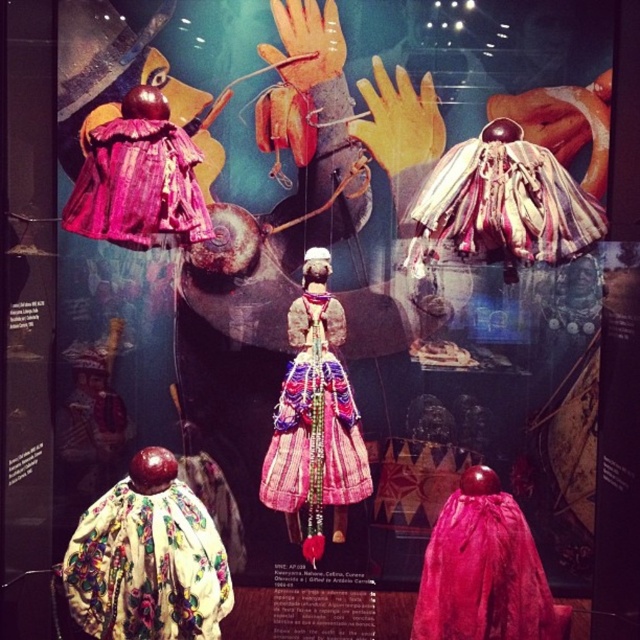
Question: Observing the image, what is the correct spatial positioning of floral fabric cape at lower left in reference to multicolored fabric cape at upper center?

Choices:
 (A) right
 (B) left

Answer: (B)

Question: Which of the following is the farthest from the observer?

Choices:
 (A) multicolored fabric dress at center
 (B) floral fabric cape at lower left
 (C) satin skirt at lower right

Answer: (A)

Question: Which of the following is the farthest from the observer?

Choices:
 (A) purple textured fabric dress at upper left
 (B) floral fabric cape at lower left
 (C) multicolored fabric dress at center
 (D) satin skirt at lower right

Answer: (C)

Question: Which of the following is the closest to the observer?

Choices:
 (A) floral fabric cape at lower left
 (B) purple textured fabric dress at upper left
 (C) satin skirt at lower right
 (D) multicolored fabric dress at center

Answer: (A)

Question: Can you confirm if multicolored fabric cape at upper center is wider than satin skirt at lower right?

Choices:
 (A) no
 (B) yes

Answer: (B)

Question: Does floral fabric cape at lower left have a larger size compared to multicolored fabric dress at center?

Choices:
 (A) no
 (B) yes

Answer: (B)